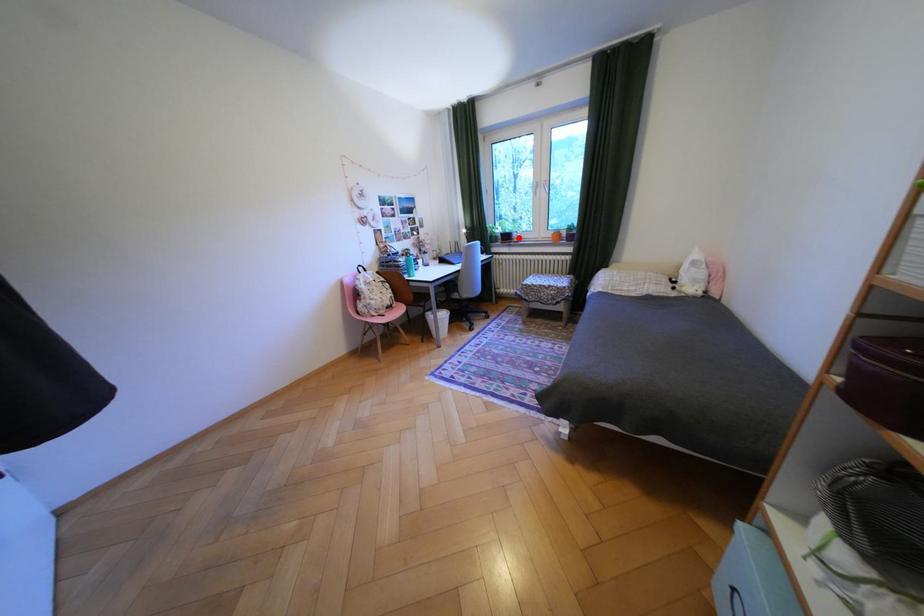
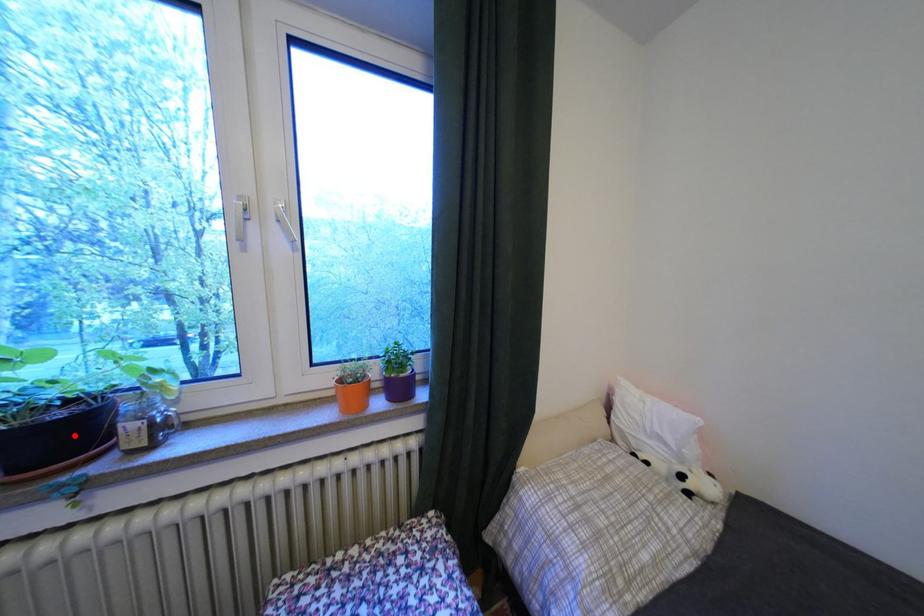
I am providing you with two images of the same scene from different viewpoints. A red point is marked on the first image and another point is marked on the second image. Are the points marked in image1 and image2 representing the same 3D position?

Yes